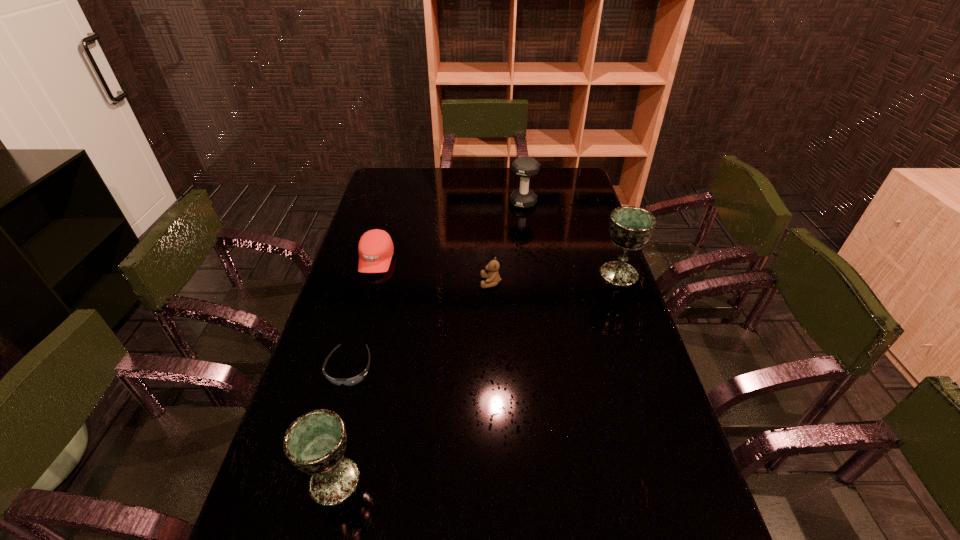
If equal spacing is desired by inserting an extra chalice among them, please point out a free spot for this new chalice. Please provide its 2D coordinates. Your answer should be formatted as a tuple, i.e. [(x, y)], where the tuple contains the x and y coordinates of a point satisfying the conditions above.

[(507, 355)]